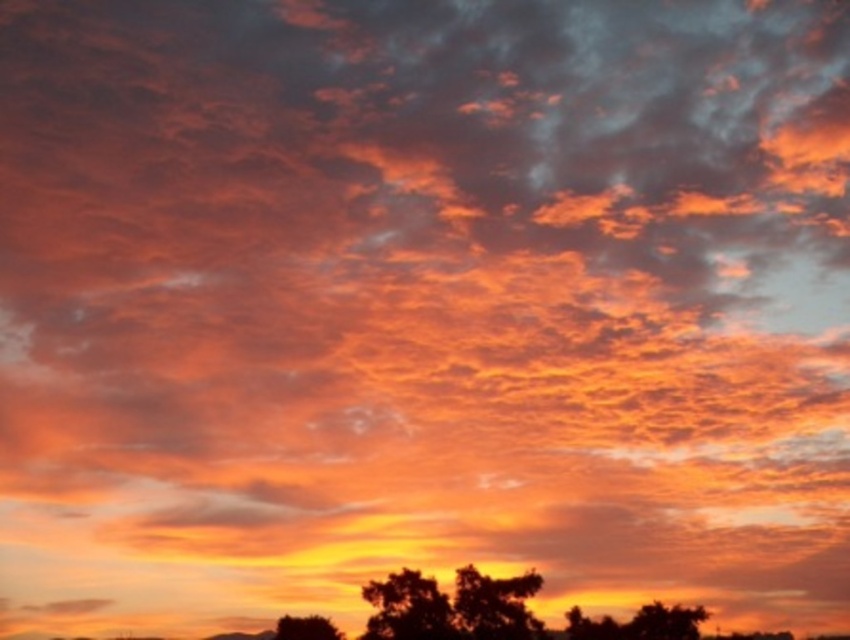
Between green leafy tree at lower right and silhouette leafy tree at lower center, which one has less height?

Standing shorter between the two is silhouette leafy tree at lower center.

Which is behind, point (683, 611) or point (282, 625)?

Point (282, 625)

Where is `green leafy tree at lower right`? green leafy tree at lower right is located at coordinates (664, 621).

Who is positioned more to the right, silhouette tree at lower center or black matte tree at lower center?

silhouette tree at lower center

Can you confirm if silhouette tree at lower center is taller than black matte tree at lower center?

Yes, silhouette tree at lower center is taller than black matte tree at lower center.

This screenshot has width=850, height=640. I want to click on silhouette tree at lower center, so click(452, 608).

Does silhouetted leafy tree at lower center appear over silhouette leafy tree at lower center?

Indeed, silhouetted leafy tree at lower center is positioned over silhouette leafy tree at lower center.

Locate an element on the screen. The width and height of the screenshot is (850, 640). silhouetted leafy tree at lower center is located at coordinates (496, 605).